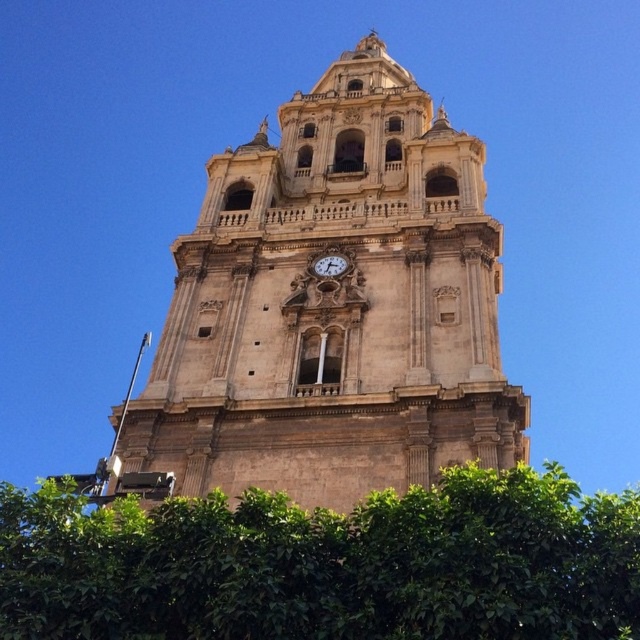
You are standing in front of the historic tower and notice two structures at the center of the image. The beige stone clock tower at center and the green leafy tree at center. Which one has a narrower width?

The beige stone clock tower at center is thinner than the green leafy tree at center, so the beige stone clock tower at center has a narrower width.

You are an architect planning to add a new decorative element to the beige stone clock tower at center and the white marble clock at center. Since you want to maintain visual balance, which tower should receive a smaller ornament to avoid overwhelming its structure?

The white marble clock at center should receive the smaller ornament because it is smaller in size compared to the beige stone clock tower at center.

You are standing at the base of the historic tower and want to measure the distance to a specific point on the tower. The point you are interested in is labeled as point (124, 451). Can you determine how far this point is from your current position?

The point (124, 451) is 45.47 meters away from the viewer, so the distance is 45.47 meters.